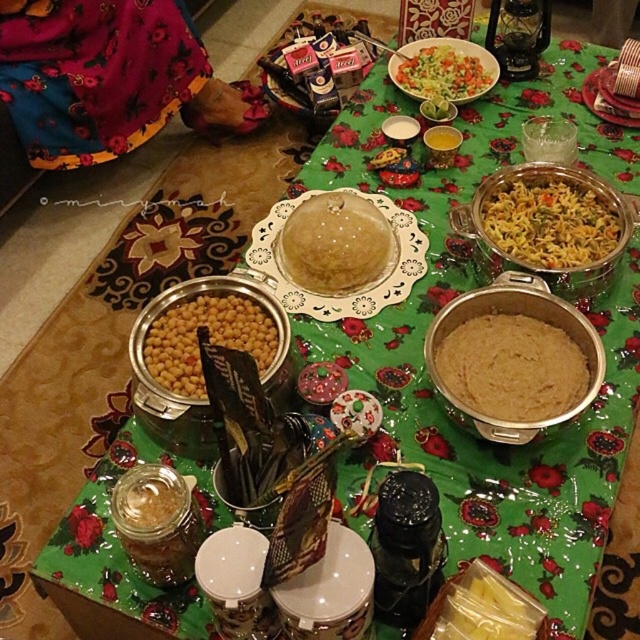
Question: Can you confirm if floral fabric skirt at upper left is thinner than green leafy salad at center?

Choices:
 (A) no
 (B) yes

Answer: (A)

Question: Which point is closer to the camera?

Choices:
 (A) floral fabric skirt at upper left
 (B) yellowish matte pasta at center-right

Answer: (B)

Question: Can you confirm if translucent glass dome at center is positioned to the left of translucent plastic bag at center?

Choices:
 (A) yes
 (B) no

Answer: (A)

Question: Which of these objects is positioned closest to the yellowish matte pasta at center-right?

Choices:
 (A) translucent plastic bag at center
 (B) floral fabric skirt at upper left
 (C) translucent glass dome at center

Answer: (C)

Question: Among these points, which one is nearest to the camera?

Choices:
 (A) (436, 54)
 (B) (508, 592)
 (C) (88, 99)

Answer: (B)

Question: Is yellowish matte pasta at center-right below green leafy salad at center?

Choices:
 (A) no
 (B) yes

Answer: (B)